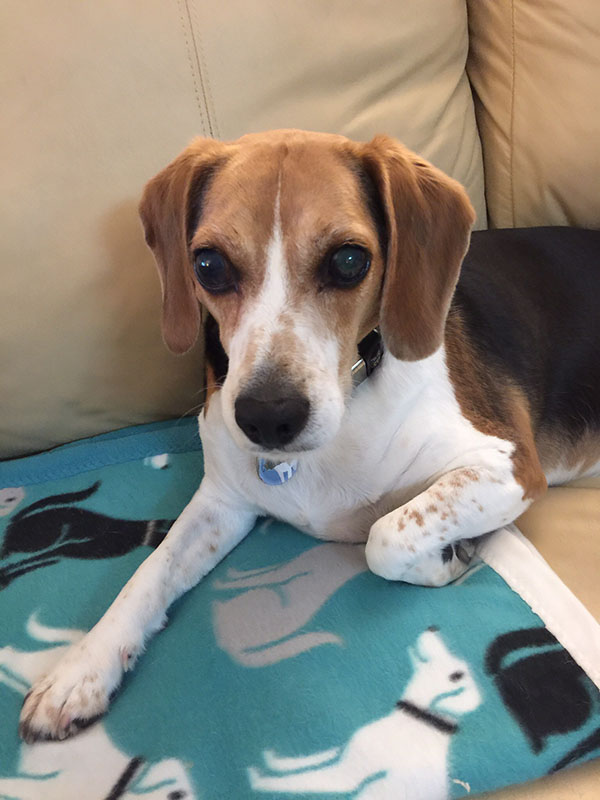
This screenshot has width=600, height=800. In order to click on right pillow in this screenshot , I will do `click(516, 66)`.